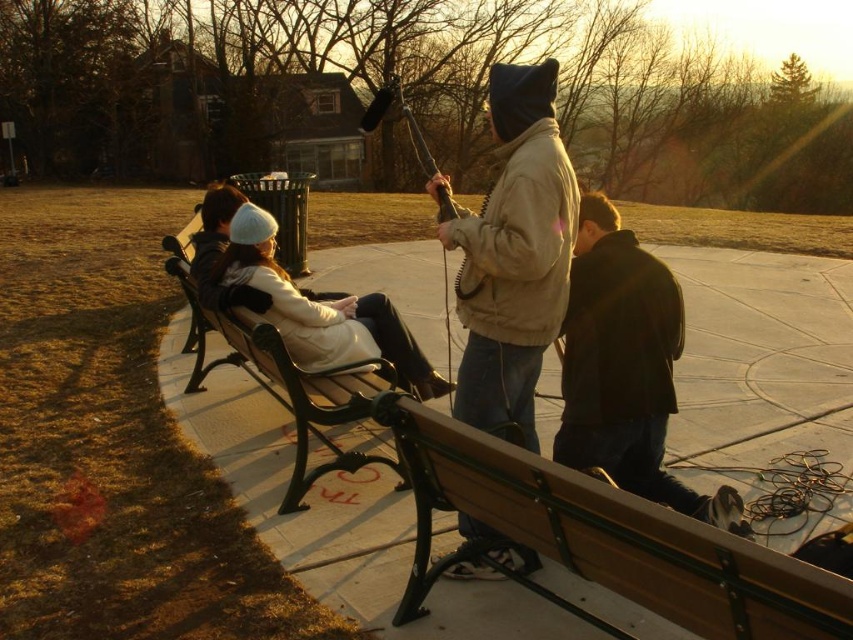
Which is more to the right, dark brown leather jacket at lower right or white woolen hat at center?

dark brown leather jacket at lower right

Consider the image. Measure the distance between dark brown leather jacket at lower right and camera.

They are 3.01 meters apart.

Describe the element at coordinates (625, 368) in the screenshot. The height and width of the screenshot is (640, 853). I see `dark brown leather jacket at lower right` at that location.

Where is `dark brown leather jacket at lower right`? The image size is (853, 640). dark brown leather jacket at lower right is located at coordinates click(625, 368).

Is the position of beige cotton jacket at center more distant than that of white woolen hat at center?

That is False.

What do you see at coordinates (514, 253) in the screenshot? I see `beige cotton jacket at center` at bounding box center [514, 253].

The image size is (853, 640). Find the location of `beige cotton jacket at center`. beige cotton jacket at center is located at coordinates (514, 253).

At what (x,y) coordinates should I click in order to perform the action: click on beige cotton jacket at center. Please return your answer as a coordinate pair (x, y). Looking at the image, I should click on (514, 253).

Measure the distance between wooden park bench at lower right and beige cotton jacket at center.

wooden park bench at lower right is 78.14 centimeters from beige cotton jacket at center.

In the scene shown: Does wooden park bench at lower right appear over beige cotton jacket at center?

No, wooden park bench at lower right is not above beige cotton jacket at center.

The height and width of the screenshot is (640, 853). What do you see at coordinates (601, 540) in the screenshot?
I see `wooden park bench at lower right` at bounding box center [601, 540].

This screenshot has width=853, height=640. I want to click on wooden park bench at lower right, so click(x=601, y=540).